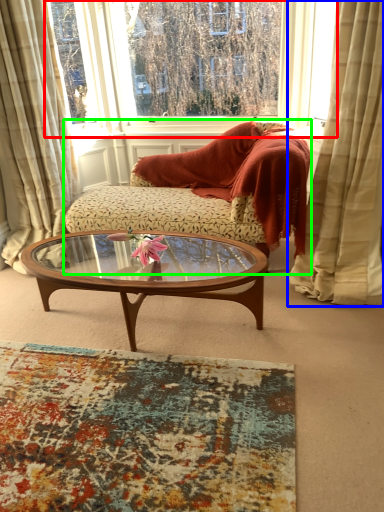
Question: Which is farther away from window (highlighted by a red box)? curtain (highlighted by a blue box) or studio couch (highlighted by a green box)?

Choices:
 (A) curtain
 (B) studio couch

Answer: (A)